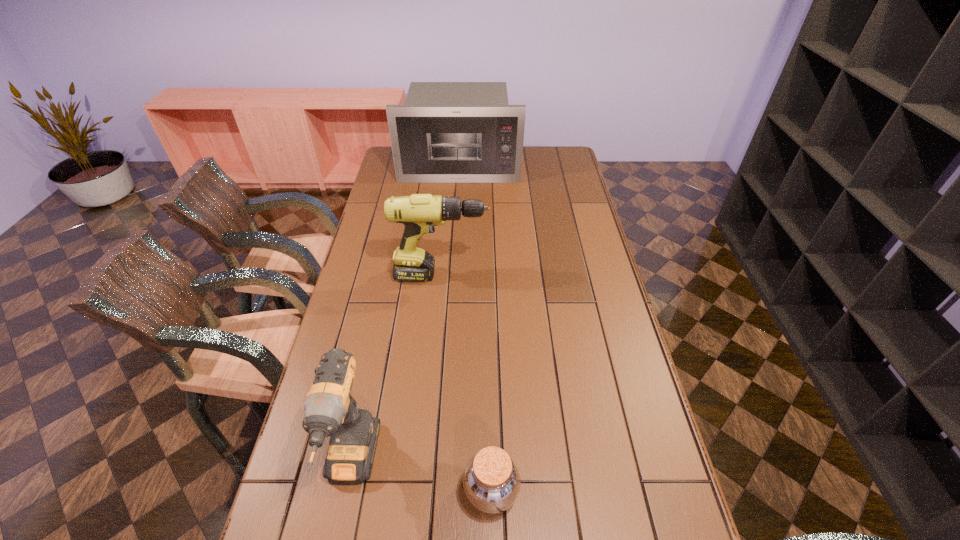
In the image, there is a desktop. Find the location of `vacant space at the left edge`. vacant space at the left edge is located at coordinates pyautogui.click(x=387, y=287).

Locate an element on the screen. The height and width of the screenshot is (540, 960). blank space at the right edge of the desktop is located at coordinates (640, 376).

Find the location of a particular element. The width and height of the screenshot is (960, 540). vacant space at the far right corner of the desktop is located at coordinates click(x=556, y=147).

The height and width of the screenshot is (540, 960). I want to click on free space between the nearer drill and the farther drill, so click(x=396, y=371).

Find the location of a particular element. The image size is (960, 540). free spot between the nearer drill and the farther drill is located at coordinates (396, 371).

Locate an element on the screen. free point between the microwave oven and the farther drill is located at coordinates (450, 221).

I want to click on vacant area that lies between the farther drill and the shortest object, so click(x=467, y=383).

Locate an element on the screen. free spot between the farthest object and the farther drill is located at coordinates (450, 221).

You are a GUI agent. You are given a task and a screenshot of the screen. Output one action in this format:
    pyautogui.click(x=<x>, y=<y>)
    Task: Click on the free spot between the farthest object and the second farthest object
    The image size is (960, 540).
    Given the screenshot: What is the action you would take?
    pyautogui.click(x=450, y=221)

Where is `free space between the shortest object and the nearer drill`? The height and width of the screenshot is (540, 960). free space between the shortest object and the nearer drill is located at coordinates (421, 478).